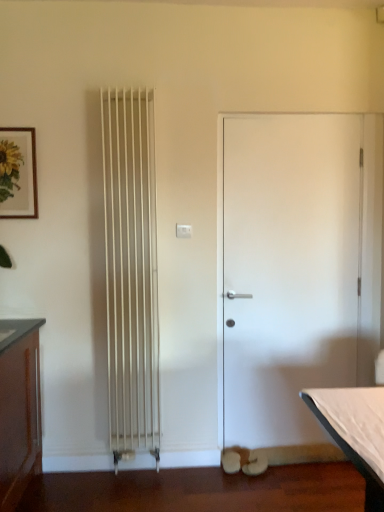
Measure the distance between point [300,182] and camera.

Point [300,182] and camera are 8.23 feet apart from each other.

Find the location of a particular element. This screenshot has height=512, width=384. white matte door at center is located at coordinates (288, 275).

The height and width of the screenshot is (512, 384). What do you see at coordinates (288, 275) in the screenshot?
I see `white matte door at center` at bounding box center [288, 275].

The width and height of the screenshot is (384, 512). I want to click on wooden framed sunflower print at upper left, so click(x=18, y=173).

The width and height of the screenshot is (384, 512). What do you see at coordinates (18, 173) in the screenshot? I see `wooden framed sunflower print at upper left` at bounding box center [18, 173].

What are the coordinates of `white matte door at center` in the screenshot? It's located at (288, 275).

Between wooden framed sunflower print at upper left and white matte door at center, which one appears on the right side from the viewer's perspective?

white matte door at center is more to the right.

Considering the positions of objects wooden framed sunflower print at upper left and white matte door at center in the image provided, who is in front, wooden framed sunflower print at upper left or white matte door at center?

wooden framed sunflower print at upper left is more forward.

Does point (23, 143) appear closer or farther from the camera than point (309, 355)?

Point (23, 143).

From the picture: From the image's perspective, between wooden framed sunflower print at upper left and white matte door at center, who is located below?

white matte door at center appears lower in the image.

From a real-world perspective, which is physically below, wooden framed sunflower print at upper left or white matte door at center?

From a 3D spatial view, white matte door at center is below.

Between wooden framed sunflower print at upper left and white matte door at center, which one has larger width?

white matte door at center is wider.

Can you confirm if wooden framed sunflower print at upper left is shorter than white matte door at center?

Correct, wooden framed sunflower print at upper left is not as tall as white matte door at center.

Between wooden framed sunflower print at upper left and white matte door at center, which one has smaller size?

wooden framed sunflower print at upper left is smaller.

Is wooden framed sunflower print at upper left surrounding white matte door at center?

No, white matte door at center is not a part of wooden framed sunflower print at upper left.

Is wooden framed sunflower print at upper left not near white matte door at center?

Absolutely, wooden framed sunflower print at upper left is distant from white matte door at center.

Is wooden framed sunflower print at upper left aimed at white matte door at center?

No, wooden framed sunflower print at upper left does not turn towards white matte door at center.

Measure the distance between wooden framed sunflower print at upper left and white matte door at center.

wooden framed sunflower print at upper left and white matte door at center are 1.41 meters apart.

I want to click on picture frame in front of the white matte door at center, so click(x=18, y=173).

Is white matte door at center to the right of wooden framed sunflower print at upper left from the viewer's perspective?

Indeed, white matte door at center is positioned on the right side of wooden framed sunflower print at upper left.

Considering their positions, is white matte door at center located in front of or behind wooden framed sunflower print at upper left?

Clearly, white matte door at center is behind wooden framed sunflower print at upper left.

Which point is more forward, (322, 440) or (32, 150)?

The point (32, 150) is closer to the camera.

From the image's perspective, between white matte door at center and wooden framed sunflower print at upper left, who is located below?

From the image's view, white matte door at center is below.

Looking at this image, from a real-world perspective, is white matte door at center positioned above or below wooden framed sunflower print at upper left?

white matte door at center is below wooden framed sunflower print at upper left.

Can you confirm if white matte door at center is wider than wooden framed sunflower print at upper left?

Indeed, white matte door at center has a greater width compared to wooden framed sunflower print at upper left.

Who is shorter, white matte door at center or wooden framed sunflower print at upper left?

With less height is wooden framed sunflower print at upper left.

Considering the relative sizes of white matte door at center and wooden framed sunflower print at upper left in the image provided, is white matte door at center bigger than wooden framed sunflower print at upper left?

Correct, white matte door at center is larger in size than wooden framed sunflower print at upper left.

Is white matte door at center positioned beyond the bounds of wooden framed sunflower print at upper left?

Indeed, white matte door at center is completely outside wooden framed sunflower print at upper left.

Is white matte door at center far from wooden framed sunflower print at upper left?

That's right, there is a large distance between white matte door at center and wooden framed sunflower print at upper left.

Is white matte door at center oriented towards wooden framed sunflower print at upper left?

No, white matte door at center is not facing towards wooden framed sunflower print at upper left.

What's the angular difference between white matte door at center and wooden framed sunflower print at upper left's facing directions?

The angle between the facing direction of white matte door at center and the facing direction of wooden framed sunflower print at upper left is 1.36 degrees.

Measure the distance from white matte door at center to wooden framed sunflower print at upper left.

white matte door at center and wooden framed sunflower print at upper left are 1.41 meters apart from each other.

Locate an element on the screen. The image size is (384, 512). door below the wooden framed sunflower print at upper left (from the image's perspective) is located at coordinates (288, 275).

Where is `door that appears on the right of wooden framed sunflower print at upper left`? This screenshot has width=384, height=512. door that appears on the right of wooden framed sunflower print at upper left is located at coordinates (288, 275).

The height and width of the screenshot is (512, 384). I want to click on picture frame above the white matte door at center (from the image's perspective), so click(18, 173).